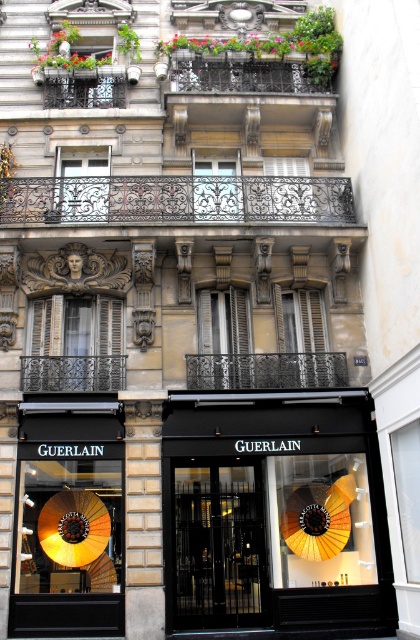
The height and width of the screenshot is (640, 420). What are the coordinates of `matte black entrance at center` in the screenshot? It's located at (275, 516).

Between matte black entrance at center and black glass door at center, which one is positioned lower?

Positioned lower is black glass door at center.

Measure the distance between matte black entrance at center and camera.

They are 84.50 feet apart.

Identify the location of matte black entrance at center. (275, 516).

Does matte black entrance at center have a larger size compared to shiny gold umbrella at lower left?

Indeed, matte black entrance at center has a larger size compared to shiny gold umbrella at lower left.

This screenshot has width=420, height=640. What do you see at coordinates (275, 516) in the screenshot?
I see `matte black entrance at center` at bounding box center [275, 516].

Locate an element on the screen. The height and width of the screenshot is (640, 420). matte black entrance at center is located at coordinates (275, 516).

Consider the image. Which is above, black glass door at center or shiny gold umbrella at lower left?

black glass door at center is higher up.

Is black glass door at center to the right of shiny gold umbrella at lower left from the viewer's perspective?

Yes, black glass door at center is to the right of shiny gold umbrella at lower left.

Is point (247, 532) in front of point (102, 500)?

No, it is behind (102, 500).

Find the location of a particular element. black glass door at center is located at coordinates (218, 545).